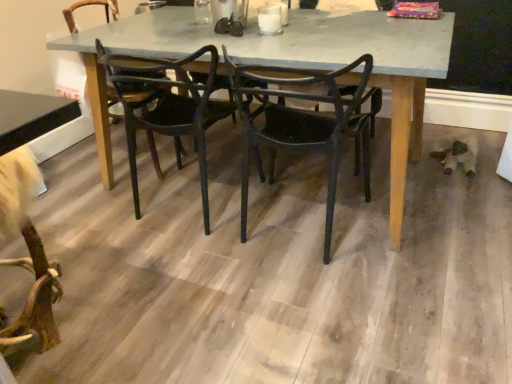
Identify the location of unoccupied area in front of matte gray table at center. The width and height of the screenshot is (512, 384). (287, 303).